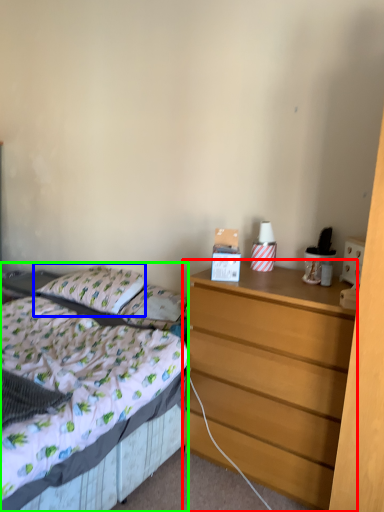
Question: Which object is the closest to the chest of drawers (highlighted by a red box)? Choose among these: pillow (highlighted by a blue box) or bed (highlighted by a green box).

Choices:
 (A) pillow
 (B) bed

Answer: (B)